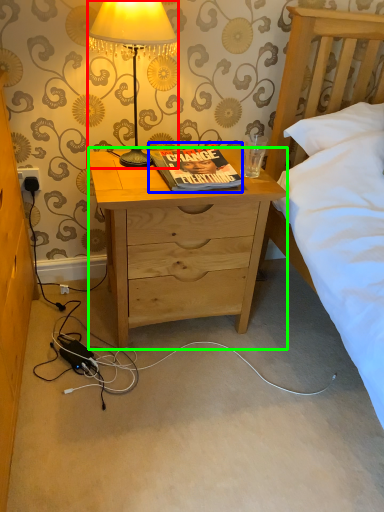
Question: Considering the real-world distances, which object is farthest from lamp (highlighted by a red box)? book (highlighted by a blue box) or desk (highlighted by a green box)?

Choices:
 (A) book
 (B) desk

Answer: (B)